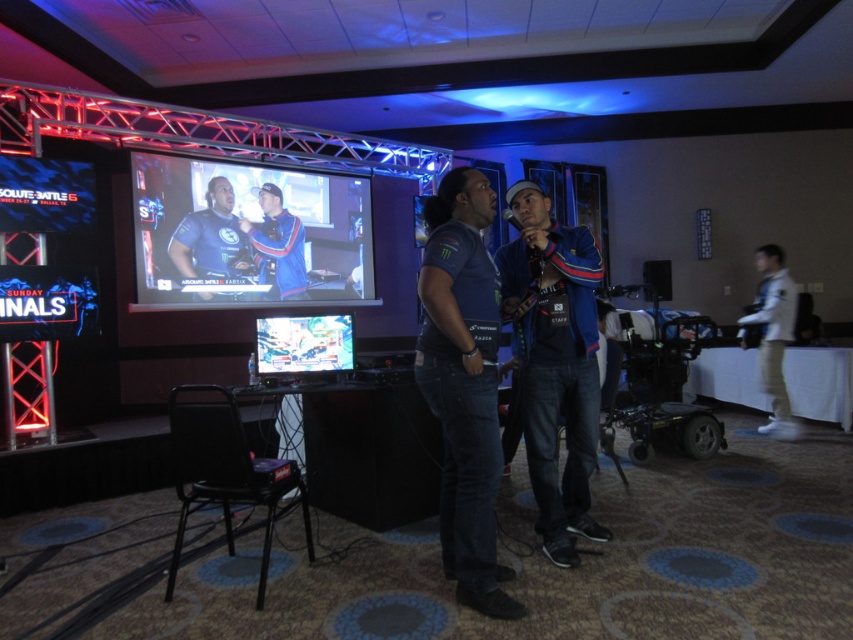
You are a photographer positioned in front of the two monitors. You need to take a clear photo of the shiny plastic monitor at center without the matte black monitor at center appearing in the background. Is this possible given their positions?

The shiny plastic monitor at center is behind the matte black monitor at center, so it would be difficult to take a clear photo of the shiny plastic monitor at center without the matte black monitor at center appearing in the background unless you move the monitors or adjust your angle.

You are a photographer positioned at the entrance of the gaming event space. You need to capture a photo of the matte black monitor at center and the dark blue denim jeans at center such that the monitor appears to the left of the jeans in the final image. Given their current positions, is this arrangement already achievable without moving any objects?

The matte black monitor at center is already positioned to the left of the dark blue denim jeans at center, so the desired arrangement is already achievable without moving any objects.